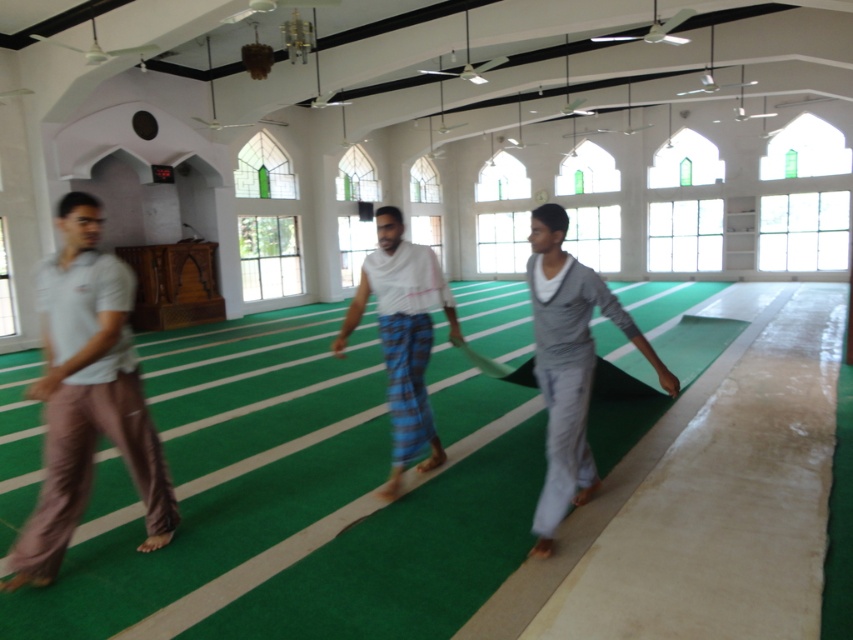
Can you confirm if gray cotton pants at center is taller than white woven cloth at center?

No.

Can you confirm if gray cotton pants at center is positioned below white woven cloth at center?

Correct, gray cotton pants at center is located below white woven cloth at center.

Which is in front, point (578, 356) or point (393, 294)?

Point (578, 356) is in front.

You are a GUI agent. You are given a task and a screenshot of the screen. Output one action in this format:
    pyautogui.click(x=<x>, y=<y>)
    Task: Click on the gray cotton pants at center
    
    Given the screenshot: What is the action you would take?
    pyautogui.click(x=569, y=365)

Does light brown cotton pants at left have a larger size compared to white woven cloth at center?

Indeed, light brown cotton pants at left has a larger size compared to white woven cloth at center.

Is light brown cotton pants at left smaller than white woven cloth at center?

No.

Locate an element on the screen. light brown cotton pants at left is located at coordinates (86, 396).

Does light brown cotton pants at left lie in front of gray cotton pants at center?

Yes, it is in front of gray cotton pants at center.

Measure the distance between point (142, 428) and camera.

They are 3.63 meters apart.

Image resolution: width=853 pixels, height=640 pixels. What are the coordinates of `light brown cotton pants at left` in the screenshot? It's located at (86, 396).